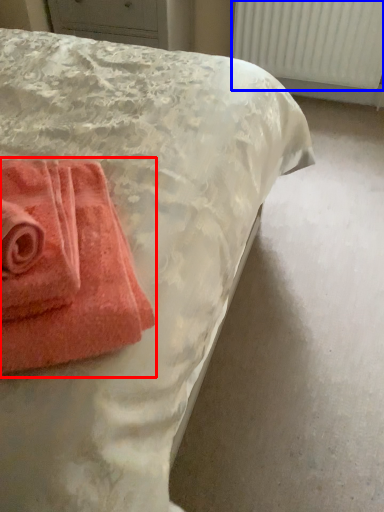
Question: Which of the following is the closest to the observer, towel (highlighted by a red box) or radiator (highlighted by a blue box)?

Choices:
 (A) towel
 (B) radiator

Answer: (A)